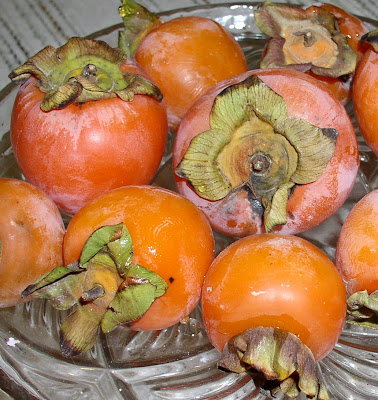
Find the location of a particular element. Image resolution: width=378 pixels, height=400 pixels. table cover is located at coordinates (37, 32).